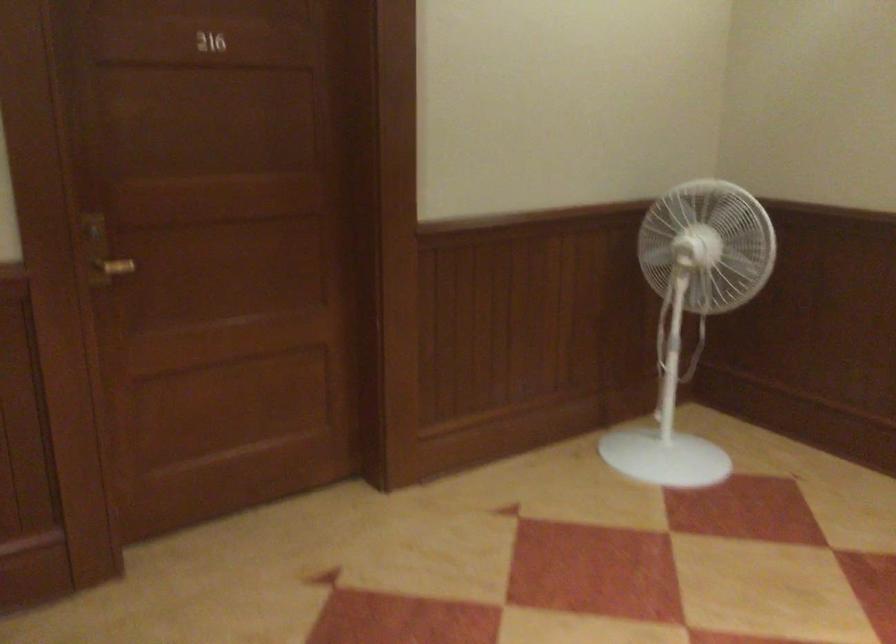
Locate an element on the screen. This screenshot has width=896, height=644. golden door handle is located at coordinates (101, 252).